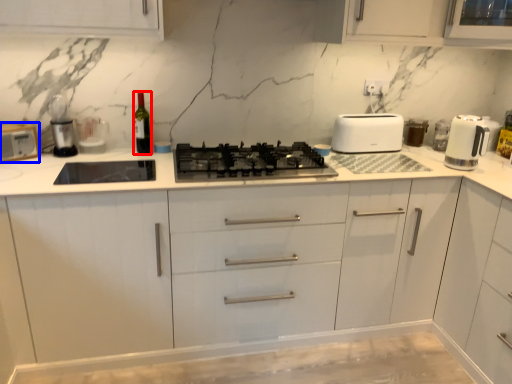
Question: Among these objects, which one is nearest to the camera, wine bottle (highlighted by a red box) or toaster (highlighted by a blue box)?

Choices:
 (A) wine bottle
 (B) toaster

Answer: (B)